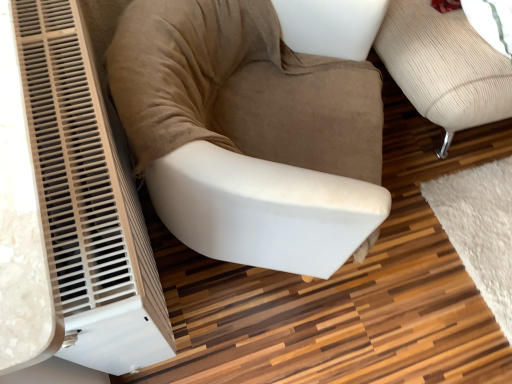
Locate an element on the screen. beige corduroy armchair at center is located at coordinates (444, 67).

Measure the distance between point (377, 47) and camera.

The distance of point (377, 47) from camera is 4.43 feet.

Image resolution: width=512 pixels, height=384 pixels. What do you see at coordinates (444, 67) in the screenshot? I see `beige corduroy armchair at center` at bounding box center [444, 67].

The width and height of the screenshot is (512, 384). What do you see at coordinates (247, 135) in the screenshot? I see `suede-like beige armchair at center-left` at bounding box center [247, 135].

Measure the distance between point (319, 164) and camera.

Point (319, 164) and camera are 1.09 meters apart.

This screenshot has width=512, height=384. I want to click on suede-like beige armchair at center-left, so click(x=247, y=135).

Where is `beige corduroy armchair at center`? Image resolution: width=512 pixels, height=384 pixels. beige corduroy armchair at center is located at coordinates (444, 67).

Is beige corduroy armchair at center at the left side of suede-like beige armchair at center-left?

Incorrect, beige corduroy armchair at center is not on the left side of suede-like beige armchair at center-left.

Which object is further away from the camera taking this photo, beige corduroy armchair at center or suede-like beige armchair at center-left?

beige corduroy armchair at center is more distant.

Considering the positions of point (401, 1) and point (218, 203), is point (401, 1) closer or farther from the camera than point (218, 203)?

Point (401, 1) appears to be farther away from the viewer than point (218, 203).

From the image's perspective, is beige corduroy armchair at center on top of suede-like beige armchair at center-left?

Yes, from the image's perspective, beige corduroy armchair at center is on top of suede-like beige armchair at center-left.

From a real-world perspective, who is located lower, beige corduroy armchair at center or suede-like beige armchair at center-left?

From a 3D spatial view, suede-like beige armchair at center-left is below.

Considering the sizes of objects beige corduroy armchair at center and suede-like beige armchair at center-left in the image provided, who is thinner, beige corduroy armchair at center or suede-like beige armchair at center-left?

suede-like beige armchair at center-left is thinner.

Can you confirm if beige corduroy armchair at center is shorter than suede-like beige armchair at center-left?

In fact, beige corduroy armchair at center may be taller than suede-like beige armchair at center-left.

Based on their sizes in the image, would you say beige corduroy armchair at center is bigger or smaller than suede-like beige armchair at center-left?

Clearly, beige corduroy armchair at center is larger in size than suede-like beige armchair at center-left.

Would you say beige corduroy armchair at center is inside or outside suede-like beige armchair at center-left?

beige corduroy armchair at center lies outside suede-like beige armchair at center-left.

Are beige corduroy armchair at center and suede-like beige armchair at center-left beside each other?

beige corduroy armchair at center and suede-like beige armchair at center-left are clearly separated.

Is beige corduroy armchair at center looking in the opposite direction of suede-like beige armchair at center-left?

No, beige corduroy armchair at center's orientation is not away from suede-like beige armchair at center-left.

What's the angular difference between beige corduroy armchair at center and suede-like beige armchair at center-left's facing directions?

They differ by 62.3 degrees in their facing directions.

How distant is beige corduroy armchair at center from suede-like beige armchair at center-left?

16.73 inches.

In the image, there is a beige corduroy armchair at center. Where is `chair below it (from the image's perspective)`? Image resolution: width=512 pixels, height=384 pixels. chair below it (from the image's perspective) is located at coordinates (247, 135).

Looking at this image, between suede-like beige armchair at center-left and beige corduroy armchair at center, which one appears on the left side from the viewer's perspective?

suede-like beige armchair at center-left.

Which object is further away from the camera taking this photo, suede-like beige armchair at center-left or beige corduroy armchair at center?

beige corduroy armchair at center is more distant.

Does point (343, 198) appear closer or farther from the camera than point (414, 32)?

Point (343, 198) is closer to the camera than point (414, 32).

From the image's perspective, is suede-like beige armchair at center-left on top of beige corduroy armchair at center?

Actually, suede-like beige armchair at center-left appears below beige corduroy armchair at center in the image.

From a real-world perspective, is suede-like beige armchair at center-left located higher than beige corduroy armchair at center?

No, from a real-world perspective, suede-like beige armchair at center-left is not over beige corduroy armchair at center

Looking at their sizes, would you say suede-like beige armchair at center-left is wider or thinner than beige corduroy armchair at center?

suede-like beige armchair at center-left is thinner than beige corduroy armchair at center.

Is suede-like beige armchair at center-left taller than beige corduroy armchair at center?

No, suede-like beige armchair at center-left is not taller than beige corduroy armchair at center.

Who is bigger, suede-like beige armchair at center-left or beige corduroy armchair at center?

beige corduroy armchair at center.

Is suede-like beige armchair at center-left completely or partially outside of beige corduroy armchair at center?

Absolutely, suede-like beige armchair at center-left is external to beige corduroy armchair at center.

Can you see suede-like beige armchair at center-left touching beige corduroy armchair at center?

suede-like beige armchair at center-left and beige corduroy armchair at center are clearly separated.

Consider the image. Is suede-like beige armchair at center-left looking in the opposite direction of beige corduroy armchair at center?

No, suede-like beige armchair at center-left is not facing away from beige corduroy armchair at center.

Can you tell me how much suede-like beige armchair at center-left and beige corduroy armchair at center differ in facing direction?

They differ by 62.3 degrees in their facing directions.

Where is `furniture above the suede-like beige armchair at center-left (from a real-world perspective)`? The image size is (512, 384). furniture above the suede-like beige armchair at center-left (from a real-world perspective) is located at coordinates (444, 67).

This screenshot has width=512, height=384. In order to click on furniture behind the suede-like beige armchair at center-left in this screenshot , I will do `click(444, 67)`.

Where is `chair that appears below the beige corduroy armchair at center (from a real-world perspective)`? The image size is (512, 384). chair that appears below the beige corduroy armchair at center (from a real-world perspective) is located at coordinates 247,135.